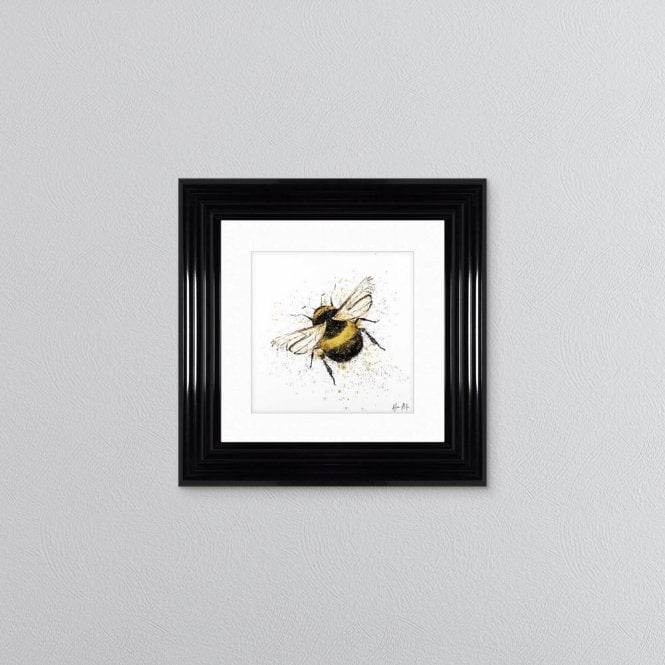
Find the location of `glossy black picture frame`. glossy black picture frame is located at coordinates click(x=465, y=354).